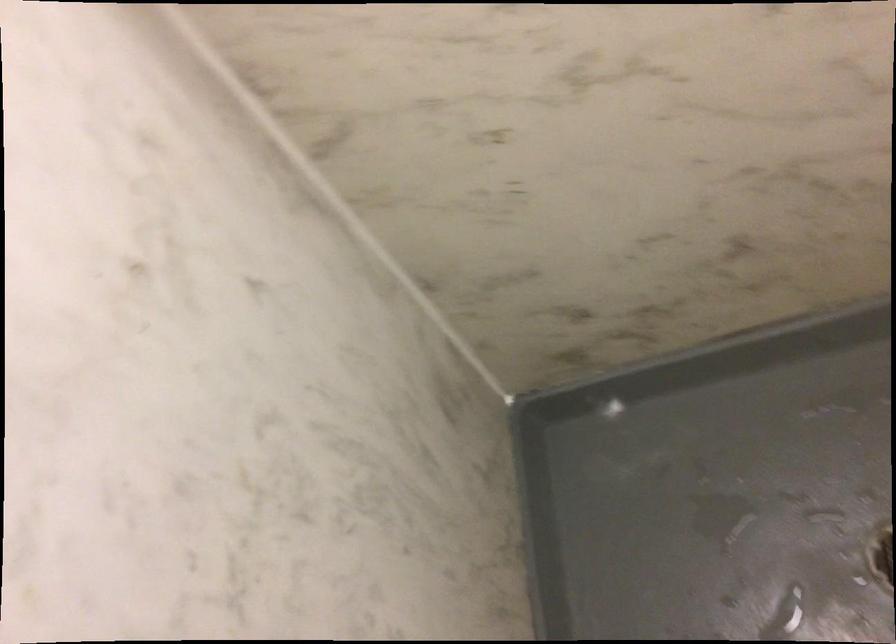
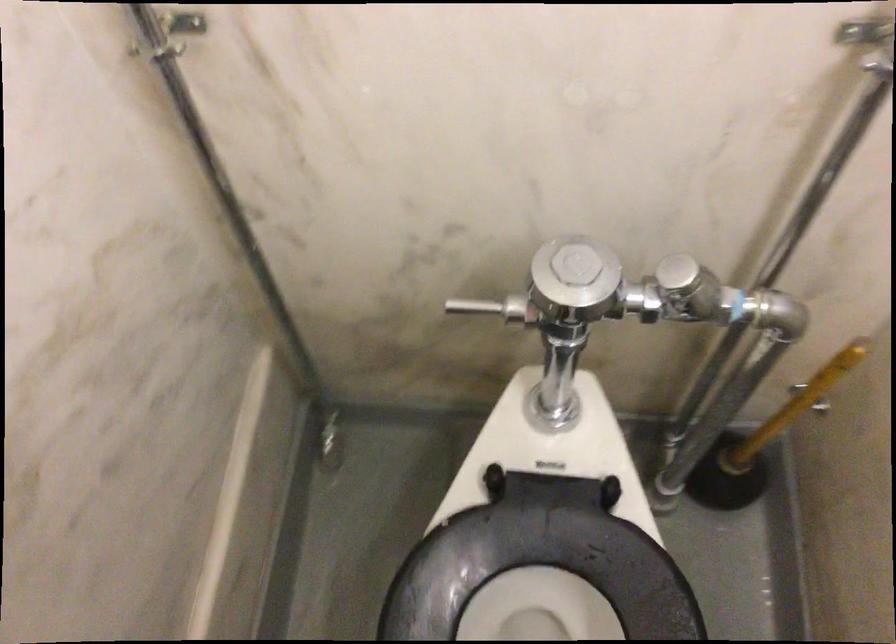
The images are taken continuously from a first-person perspective. In which direction are you moving?

The movement direction of the cameraman is right, backward.